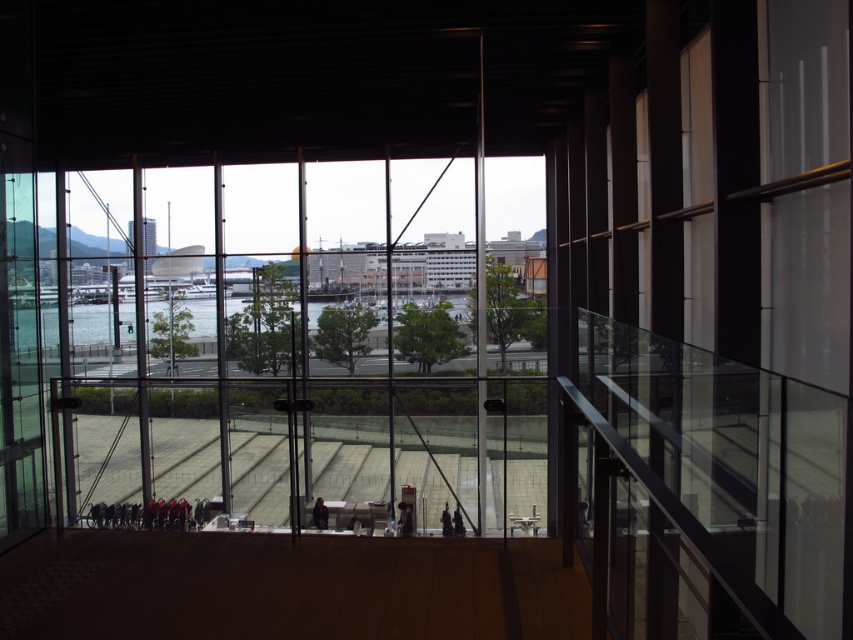
In the scene shown: Can you confirm if transparent glass window at center is smaller than clear water at center?

No.

From the picture: Is transparent glass window at center positioned behind clear water at center?

No, it is in front of clear water at center.

Is point (62, 304) in front of point (193, 304)?

Yes, it is in front of point (193, 304).

Find the location of a particular element. This screenshot has width=853, height=640. transparent glass window at center is located at coordinates (283, 348).